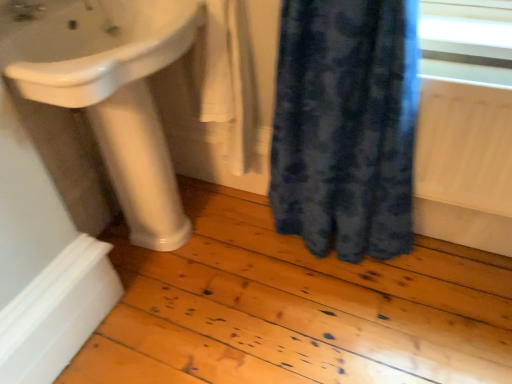
Question: Is white cotton towel at center located outside white glossy pedestal at lower left?

Choices:
 (A) no
 (B) yes

Answer: (B)

Question: Is white cotton towel at center facing away from white glossy pedestal at lower left?

Choices:
 (A) yes
 (B) no

Answer: (B)

Question: Considering the relative sizes of white cotton towel at center and white glossy pedestal at lower left in the image provided, is white cotton towel at center smaller than white glossy pedestal at lower left?

Choices:
 (A) no
 (B) yes

Answer: (B)

Question: Are white cotton towel at center and white glossy pedestal at lower left far apart?

Choices:
 (A) yes
 (B) no

Answer: (B)

Question: Does white cotton towel at center contain white glossy pedestal at lower left?

Choices:
 (A) no
 (B) yes

Answer: (A)

Question: Is white cotton towel at center in front of white glossy pedestal at lower left?

Choices:
 (A) yes
 (B) no

Answer: (B)

Question: Can we say white cotton towel at center lies outside matte white tap at upper left?

Choices:
 (A) yes
 (B) no

Answer: (A)

Question: Does white cotton towel at center have a greater width compared to matte white tap at upper left?

Choices:
 (A) yes
 (B) no

Answer: (A)

Question: Is there a large distance between white cotton towel at center and matte white tap at upper left?

Choices:
 (A) no
 (B) yes

Answer: (A)

Question: Can you confirm if white cotton towel at center is taller than matte white tap at upper left?

Choices:
 (A) yes
 (B) no

Answer: (A)

Question: Is white cotton towel at center positioned behind matte white tap at upper left?

Choices:
 (A) yes
 (B) no

Answer: (A)

Question: From a real-world perspective, is white cotton towel at center located higher than matte white tap at upper left?

Choices:
 (A) yes
 (B) no

Answer: (B)

Question: From the image's perspective, does matte white tap at upper left appear higher than white glossy pedestal at lower left?

Choices:
 (A) yes
 (B) no

Answer: (A)